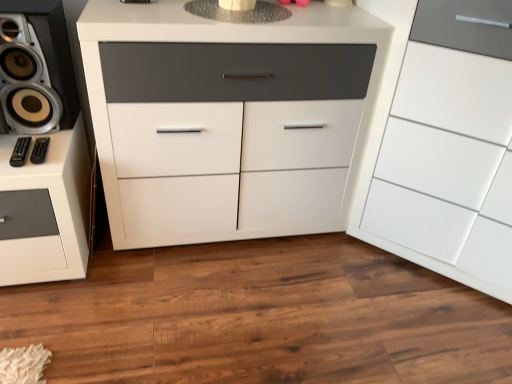
Question: Can you confirm if metallic silver speaker at left is positioned to the right of white matte cabinet at center, marked as the first chest of drawers in a left-to-right arrangement?

Choices:
 (A) no
 (B) yes

Answer: (A)

Question: Is metallic silver speaker at left closer to the viewer compared to white matte cabinet at center, marked as the first chest of drawers in a left-to-right arrangement?

Choices:
 (A) yes
 (B) no

Answer: (B)

Question: Does metallic silver speaker at left have a greater height compared to white matte cabinet at center, the 2th chest of drawers when ordered from right to left?

Choices:
 (A) no
 (B) yes

Answer: (A)

Question: From a real-world perspective, is metallic silver speaker at left below white matte cabinet at center, the 2th chest of drawers when ordered from right to left?

Choices:
 (A) yes
 (B) no

Answer: (B)

Question: Does metallic silver speaker at left have a lesser width compared to white matte cabinet at center, the 2th chest of drawers when ordered from right to left?

Choices:
 (A) no
 (B) yes

Answer: (B)

Question: Considering the relative sizes of metallic silver speaker at left and white matte cabinet at center, marked as the first chest of drawers in a left-to-right arrangement, in the image provided, is metallic silver speaker at left smaller than white matte cabinet at center, marked as the first chest of drawers in a left-to-right arrangement,?

Choices:
 (A) no
 (B) yes

Answer: (B)

Question: From a real-world perspective, is metallic silver speaker at left positioned over white glossy cabinet at right, the second chest of drawers when ordered from left to right, based on gravity?

Choices:
 (A) no
 (B) yes

Answer: (B)

Question: Is metallic silver speaker at left surrounding white glossy cabinet at right, positioned as the 1th chest of drawers in right-to-left order?

Choices:
 (A) no
 (B) yes

Answer: (A)

Question: Is metallic silver speaker at left shorter than white glossy cabinet at right, the second chest of drawers when ordered from left to right?

Choices:
 (A) no
 (B) yes

Answer: (B)

Question: Does metallic silver speaker at left have a greater width compared to white glossy cabinet at right, positioned as the 1th chest of drawers in right-to-left order?

Choices:
 (A) yes
 (B) no

Answer: (B)

Question: Does metallic silver speaker at left have a larger size compared to white glossy cabinet at right, positioned as the 1th chest of drawers in right-to-left order?

Choices:
 (A) yes
 (B) no

Answer: (B)

Question: Is metallic silver speaker at left next to white glossy cabinet at right, positioned as the 1th chest of drawers in right-to-left order, and touching it?

Choices:
 (A) no
 (B) yes

Answer: (A)

Question: Is white matte cabinet at center, marked as the first chest of drawers in a left-to-right arrangement, oriented away from black plastic remote control at lower left, which is the 1th audio in left-to-right order?

Choices:
 (A) yes
 (B) no

Answer: (B)